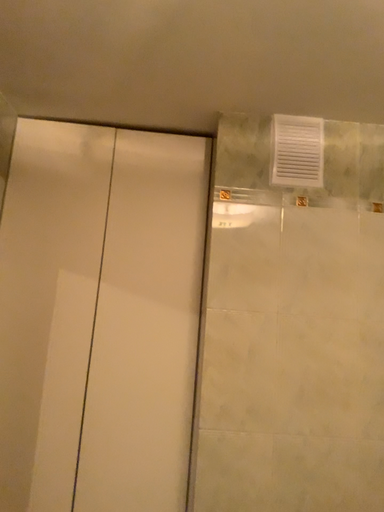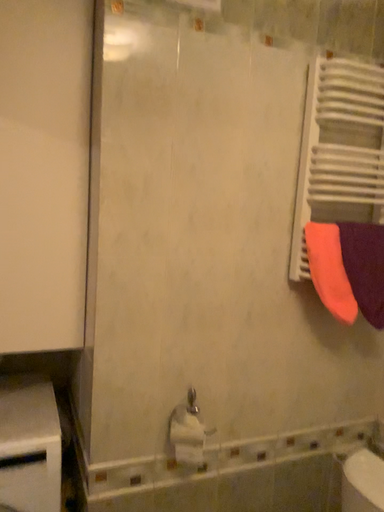
Question: Which way did the camera rotate in the video?

Choices:
 (A) rotated upward
 (B) rotated downward

Answer: (B)